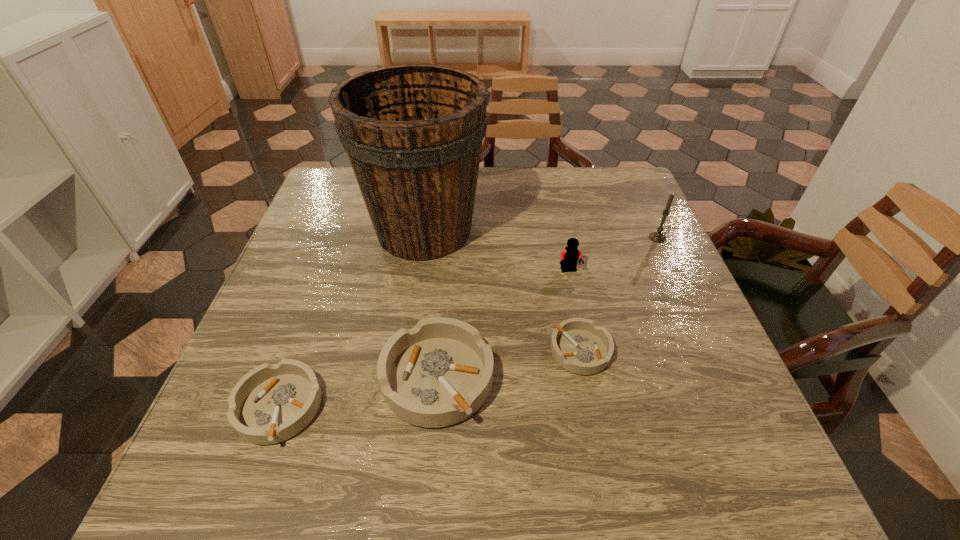
Locate an element on the screen. This screenshot has height=540, width=960. free spot that satisfies the following two spatial constraints: 1. on the front side of the tallest ashtray; 2. on the right side of the bucket is located at coordinates (403, 378).

The image size is (960, 540). In order to click on free location that satisfies the following two spatial constraints: 1. on the back side of the leftmost ashtray; 2. on the left side of the candle in this screenshot , I will do `click(340, 238)`.